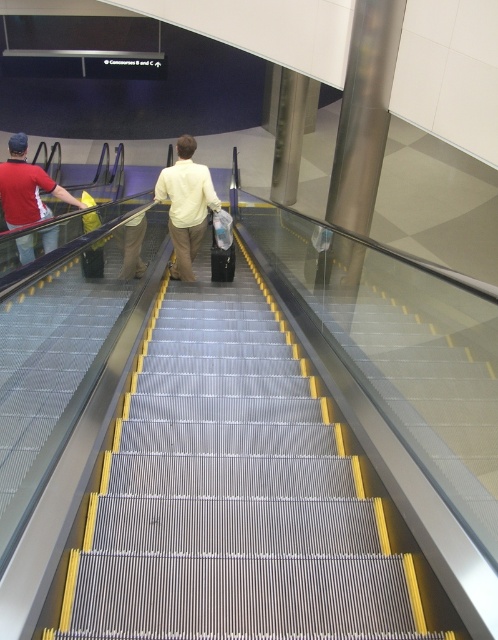
Can you confirm if light yellow shirt at center is smaller than matte red shirt at left?

Incorrect, light yellow shirt at center is not smaller in size than matte red shirt at left.

Which is behind, point (205, 172) or point (68, 193)?

The point (68, 193) is behind.

This screenshot has height=640, width=498. What are the coordinates of `light yellow shirt at center` in the screenshot? It's located at (185, 205).

Is point (149, 572) in front of point (49, 211)?

Yes, point (149, 572) is in front of point (49, 211).

Is metallic silver stairs at center smaller than matte red shirt at left?

Incorrect, metallic silver stairs at center is not smaller in size than matte red shirt at left.

Between point (88, 520) and point (44, 180), which one is positioned behind?

The point (44, 180) is behind.

At what (x,y) coordinates should I click in order to perform the action: click on metallic silver stairs at center. Please return your answer as a coordinate pair (x, y). The width and height of the screenshot is (498, 640). Looking at the image, I should click on (240, 497).

Between metallic silver stairs at center and light yellow shirt at center, which one is positioned lower?

metallic silver stairs at center is below.

Does metallic silver stairs at center appear over light yellow shirt at center?

Actually, metallic silver stairs at center is below light yellow shirt at center.

Is point (188, 605) closer to camera compared to point (205, 177)?

Yes, it is.

Where is `metallic silver stairs at center`? metallic silver stairs at center is located at coordinates (240, 497).